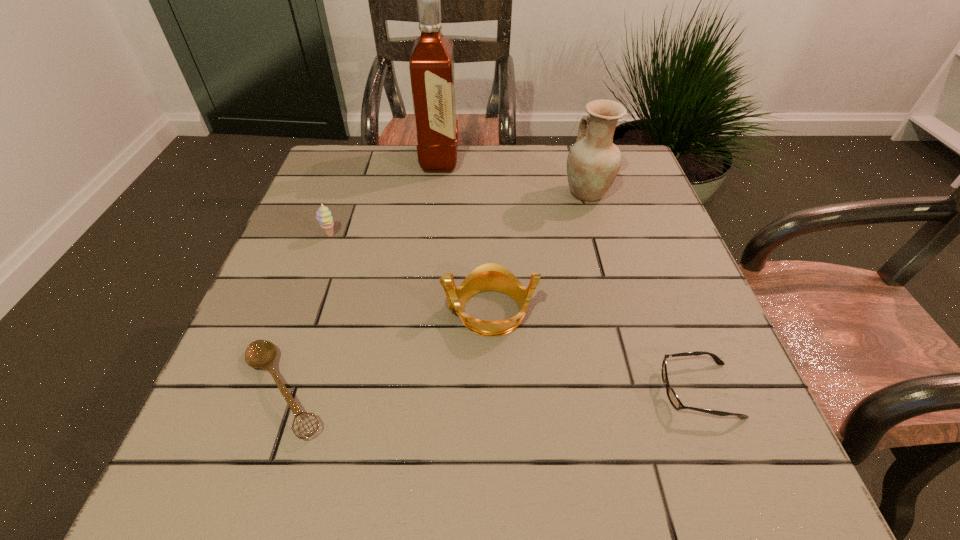
The image size is (960, 540). Identify the location of free space between the sherbert and the second shortest object. (515, 313).

Identify the location of vacant area between the spectacles and the sherbert. (515, 313).

You are a GUI agent. You are given a task and a screenshot of the screen. Output one action in this format:
    pyautogui.click(x=<x>, y=<y>)
    Task: Click on the free space between the fifth shortest object and the ladle
    
    Given the screenshot: What is the action you would take?
    pyautogui.click(x=435, y=292)

Locate which object is the fourth closest to the tallest object. Please provide its 2D coordinates. Your answer should be formatted as a tuple, i.e. [(x, y)], where the tuple contains the x and y coordinates of a point satisfying the conditions above.

[(261, 353)]

Image resolution: width=960 pixels, height=540 pixels. I want to click on object that is the fourth nearest to the tallest object, so click(x=261, y=353).

This screenshot has height=540, width=960. What are the coordinates of `blank space that satisfies the following two spatial constraints: 1. on the front side of the shortest object; 2. on the right side of the third farthest object` in the screenshot? It's located at (275, 390).

You are a GUI agent. You are given a task and a screenshot of the screen. Output one action in this format:
    pyautogui.click(x=<x>, y=<y>)
    Task: Click on the vacant space that satisfies the following two spatial constraints: 1. on the front side of the second farthest object; 2. at the front emblem of the tiara
    The image size is (960, 540).
    Given the screenshot: What is the action you would take?
    pyautogui.click(x=621, y=311)